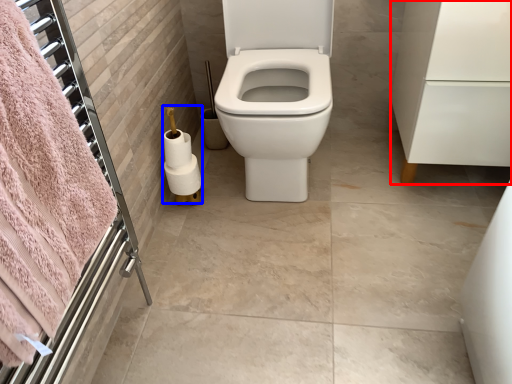
Question: Which object appears farthest to the camera in this image, porcelain (highlighted by a red box) or toilet paper (highlighted by a blue box)?

Choices:
 (A) porcelain
 (B) toilet paper

Answer: (B)